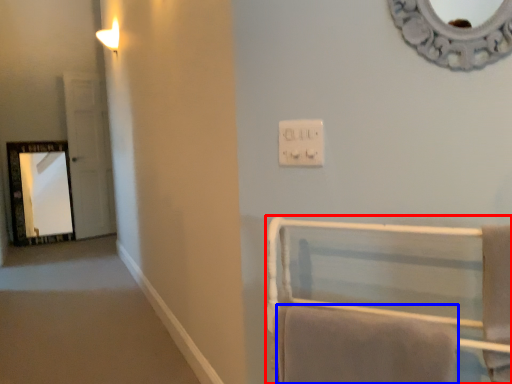
Question: Which of the following is the farthest to the observer, furniture (highlighted by a red box) or bath towel (highlighted by a blue box)?

Choices:
 (A) furniture
 (B) bath towel

Answer: (B)